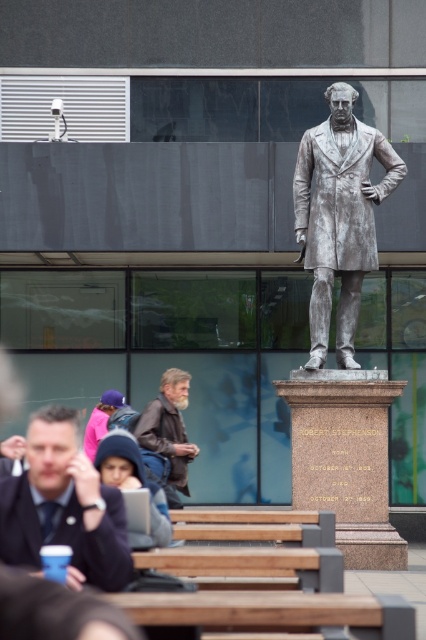
You are a tourist standing in front of the polished silver statue at center and notice a matte black jacket at lower left. Which object is closer to you?

The polished silver statue at center is closer to you since the matte black jacket at lower left is behind it.

You are a photographer trying to capture a closeup of the statue of Robert Stephenson. You notice two jackets nearby. Which jacket is wider, the matte black jacket at lower left or the brown leather jacket at lower center?

The matte black jacket at lower left is wider than the brown leather jacket at lower center according to the description.

You are a photographer planning to take a portrait of the polished silver statue at center and the matte black jacket at lower left. Since you want to ensure both subjects are in focus, you need to know which one is closer to you. Can you determine which object is nearer based on their sizes?

The polished silver statue at center is larger in size compared to the matte black jacket at lower left, so it is closer to you.